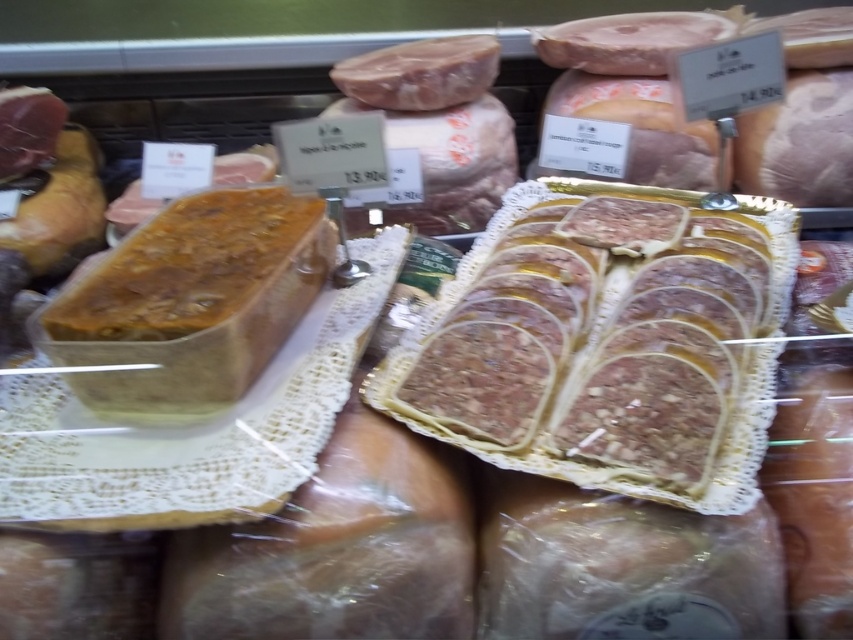
Question: Is sliced brown meat at center to the left of brown crumbly loaf at center from the viewer's perspective?

Choices:
 (A) yes
 (B) no

Answer: (B)

Question: Which point appears closest to the camera in this image?

Choices:
 (A) (186, 252)
 (B) (637, 200)

Answer: (A)

Question: Can you confirm if sliced brown meat at center is positioned to the left of brown crumbly loaf at center?

Choices:
 (A) yes
 (B) no

Answer: (B)

Question: Is sliced brown meat at center to the right of brown crumbly loaf at center from the viewer's perspective?

Choices:
 (A) no
 (B) yes

Answer: (B)